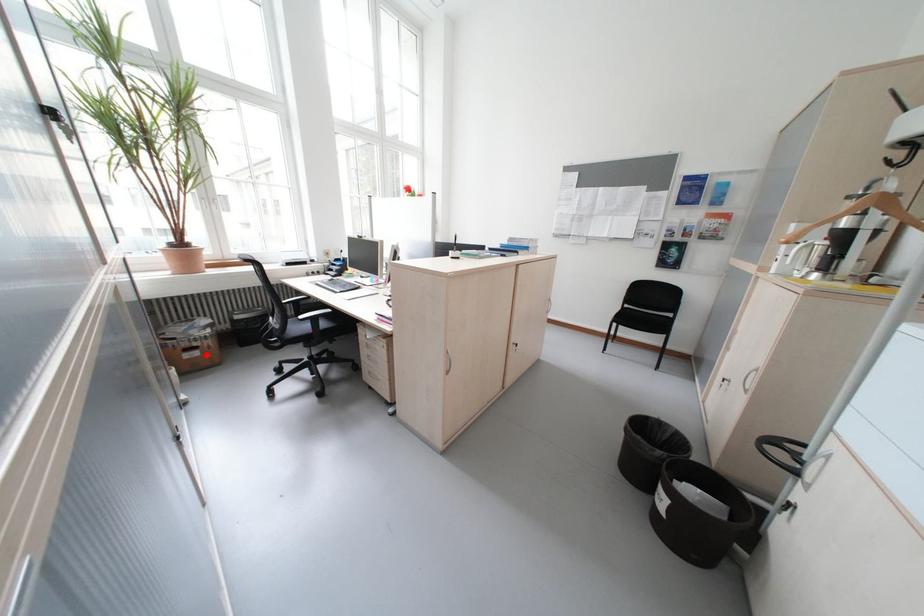
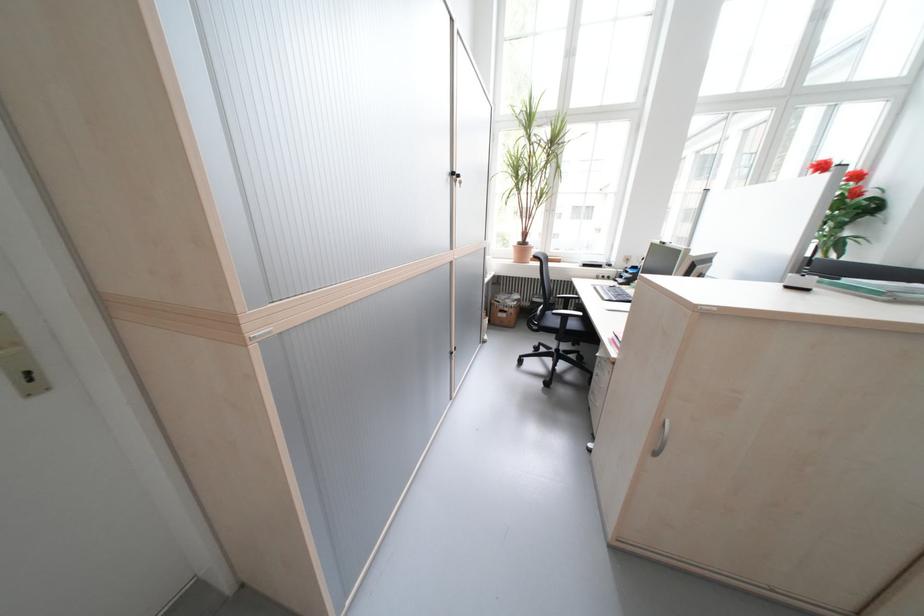
In the second image, find the point that corresponds to the highlighted location in the first image.

(515, 315)